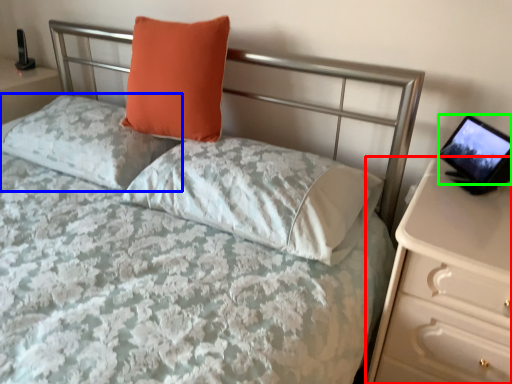
Question: Which object is positioned closest to nightstand (highlighted by a red box)? Select from pillow (highlighted by a blue box) and computer screen (highlighted by a green box).

Choices:
 (A) pillow
 (B) computer screen

Answer: (B)